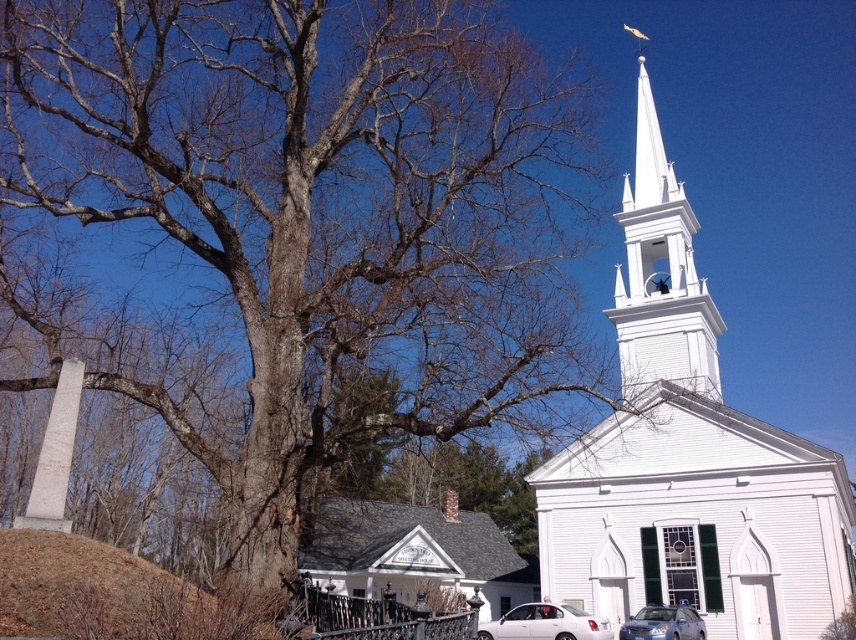
Question: Which of these objects is positioned closest to the white glossy sedan at center?

Choices:
 (A) white wooden church steeple at upper center
 (B) satin silver sedan at lower center

Answer: (B)

Question: Which of the following is the farthest from the observer?

Choices:
 (A) (360, 602)
 (B) (651, 132)
 (C) (21, 632)
 (D) (658, 630)

Answer: (B)

Question: Is white wooden steeple at upper right wider than white glossy sedan at center?

Choices:
 (A) no
 (B) yes

Answer: (B)

Question: Does white wooden church steeple at upper center have a smaller size compared to white glossy sedan at center?

Choices:
 (A) yes
 (B) no

Answer: (B)

Question: Can you confirm if white wooden steeple at upper right is positioned above brown dirt mound at lower left?

Choices:
 (A) yes
 (B) no

Answer: (A)

Question: Among these objects, which one is nearest to the camera?

Choices:
 (A) white glossy sedan at center
 (B) brown dirt mound at lower left
 (C) black wrought iron fence at lower center

Answer: (B)